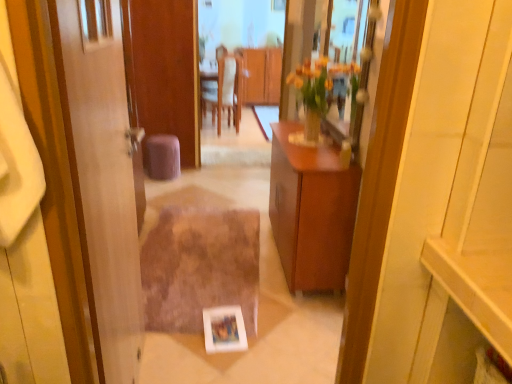
Question: Is purple fabric stool at center bigger or smaller than wooden cabinet at center, the 1th cabinetry viewed from the top?

Choices:
 (A) big
 (B) small

Answer: (B)

Question: In terms of height, does purple fabric stool at center look taller or shorter compared to wooden cabinet at center, the 1th cabinetry viewed from the top?

Choices:
 (A) tall
 (B) short

Answer: (B)

Question: Based on their relative distances, which object is farther from the clear glass mirror at upper center, placed as the second mirror when sorted from left to right?

Choices:
 (A) purple fabric stool at center
 (B) wooden cabinet at center, positioned as the 1th cabinetry in back-to-front order
 (C) wooden door at left
 (D) wooden cabinet at center, which ranks as the 2th cabinetry in top-to-bottom order
 (E) brown shaggy rug at center

Answer: (B)

Question: Estimate the real-world distances between objects in this image. Which object is closer to the white leather chair at center?

Choices:
 (A) wooden table at center, which is counted as the first mirror, starting from the left
 (B) clear glass mirror at upper center, the first mirror positioned from the right
 (C) brown shaggy rug at center
 (D) wooden door at left
 (E) wooden cabinet at center, positioned as the 1th cabinetry in back-to-front order

Answer: (A)